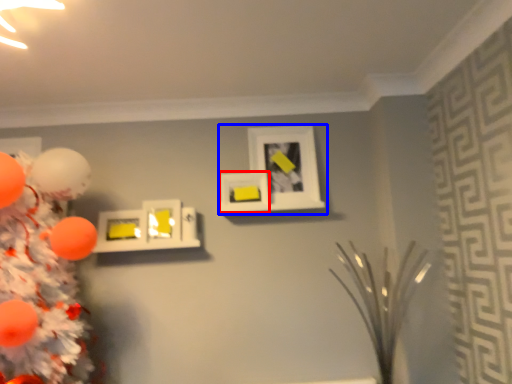
Question: Which object appears closest to the camera in this image, picture frame (highlighted by a red box) or picture frame (highlighted by a blue box)?

Choices:
 (A) picture frame
 (B) picture frame

Answer: (A)